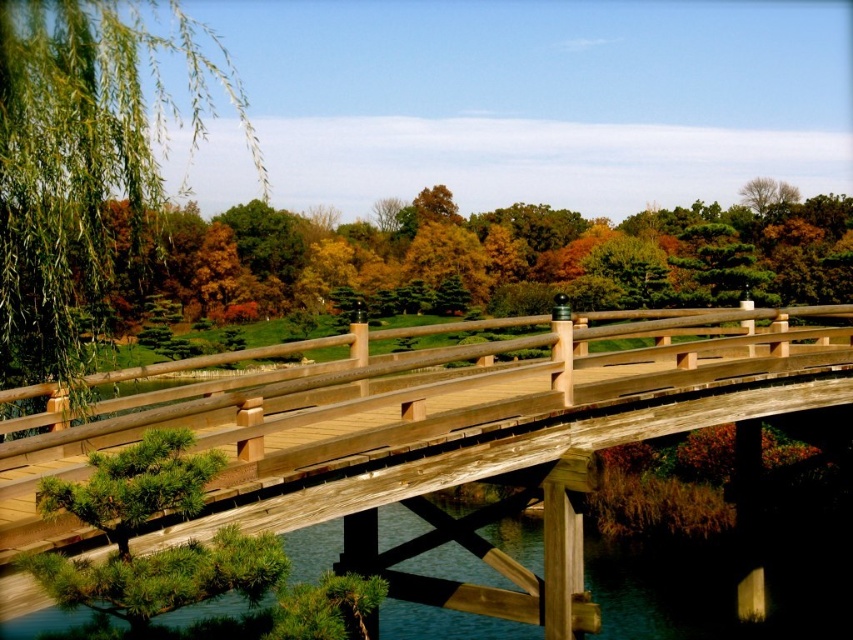
You are an architect designing a new park layout. You need to place a wooden bridge at center and a green leafy willow at left in such a way that they don not block each other. Given their widths, which object should be placed closer to the visitor entrance to ensure visibility?

The wooden bridge at center is thinner than the green leafy willow at left, so placing the green leafy willow at left closer to the visitor entrance would block the view of the wooden bridge at center. To ensure visibility, the wooden bridge at center should be placed closer to the visitor entrance since it is narrower and less likely to obstruct the view of the wider green leafy willow at left.

You are standing on the wooden bridge at center and want to take a photo of the green matte tree at upper left. In which direction should you point your camera to capture the tree in the frame?

You should point your camera to the left because the wooden bridge at center is to the right of the green matte tree at upper left, meaning the tree is located to the left side of the bridge.